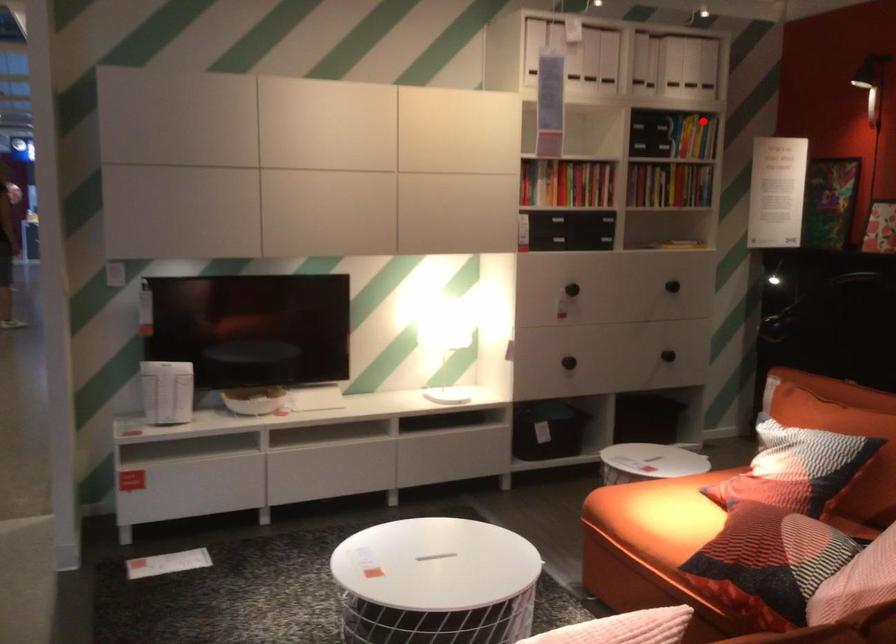
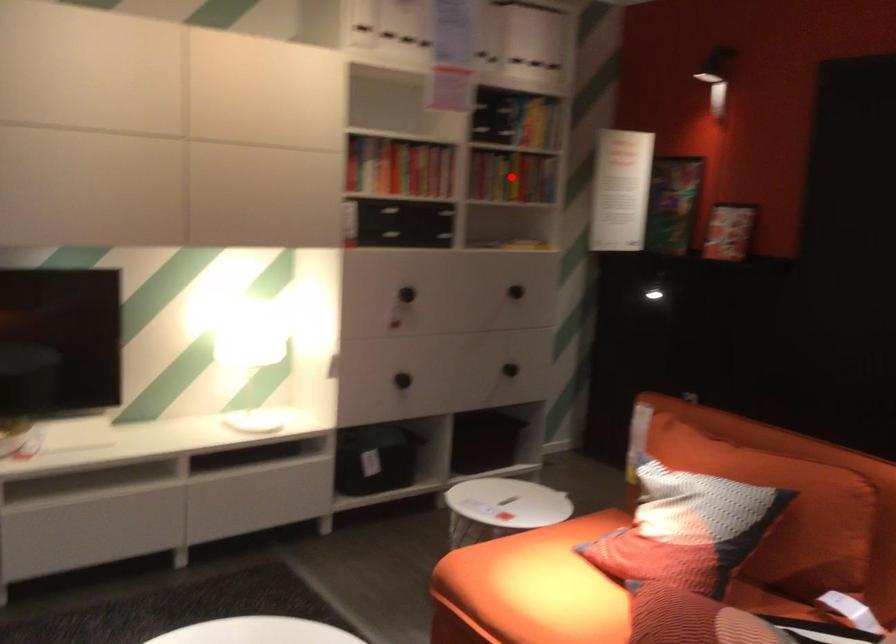
I am providing you with two images of the same scene from different viewpoints. A red point is marked on the first image and another point is marked on the second image. Does the point marked in image1 correspond to the same location as the one in image2?

No